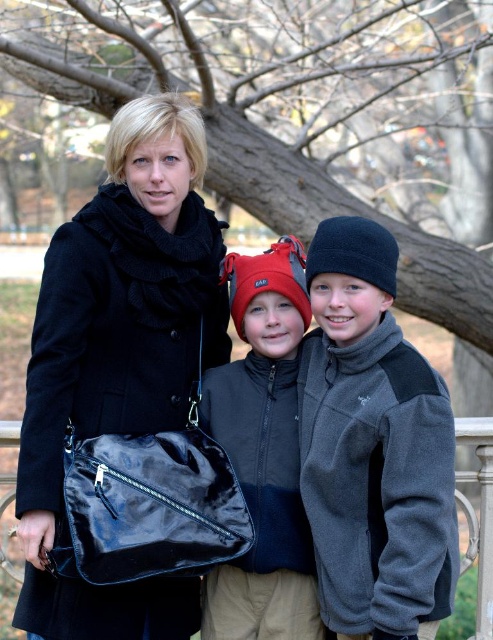
Can you confirm if dark gray fleece jacket at center is positioned to the left of glossy black bag at lower center?

Correct, you'll find dark gray fleece jacket at center to the left of glossy black bag at lower center.

Is point (358, 368) farther from camera compared to point (12, 420)?

That is False.

Where is `dark gray fleece jacket at center`? This screenshot has height=640, width=493. dark gray fleece jacket at center is located at coordinates (373, 445).

Between dark gray fleece jacket at center and brown bark tree at center, which one has more height?

dark gray fleece jacket at center

Is dark gray fleece jacket at center bigger than brown bark tree at center?

Yes.

The width and height of the screenshot is (493, 640). Identify the location of dark gray fleece jacket at center. (373, 445).

You are a GUI agent. You are given a task and a screenshot of the screen. Output one action in this format:
    pyautogui.click(x=<x>, y=<y>)
    Task: Click on the dark gray fleece jacket at center
    The width and height of the screenshot is (493, 640).
    Given the screenshot: What is the action you would take?
    pyautogui.click(x=373, y=445)

Is point (121, 275) in front of point (274, 563)?

No, (121, 275) is further to viewer.

Which is more to the left, velvet black coat at center or matte black jacket at center?

velvet black coat at center

Does point (69, 326) come farther from viewer compared to point (236, 381)?

That is False.

The image size is (493, 640). In order to click on velvet black coat at center in this screenshot , I will do `click(119, 355)`.